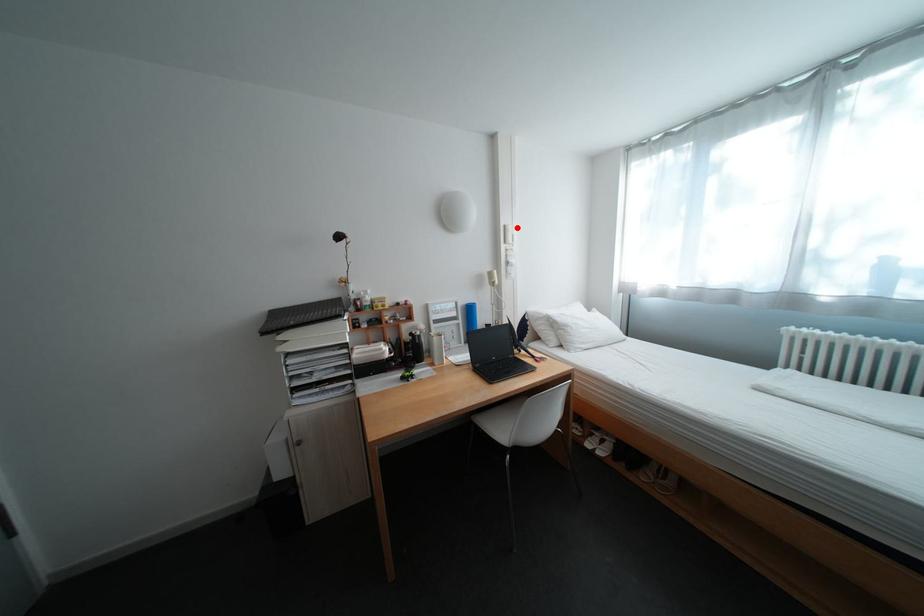
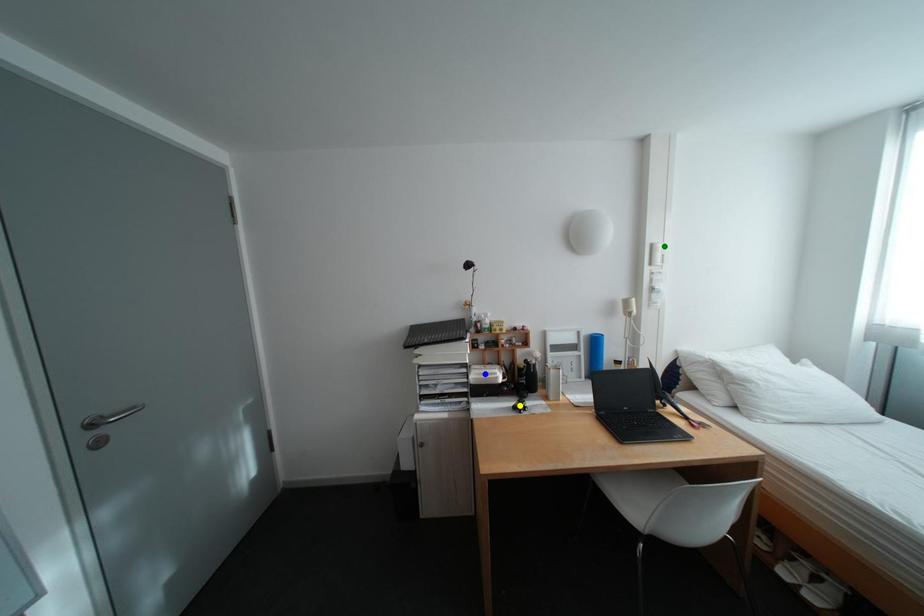
Question: I am providing you with two images of the same scene from different viewpoints. A red point is marked on the first image. You are given multiple points on the second image. Which mark in image 2 goes with the point in image 1?

Choices:
 (A) blue point
 (B) yellow point
 (C) green point

Answer: (C)